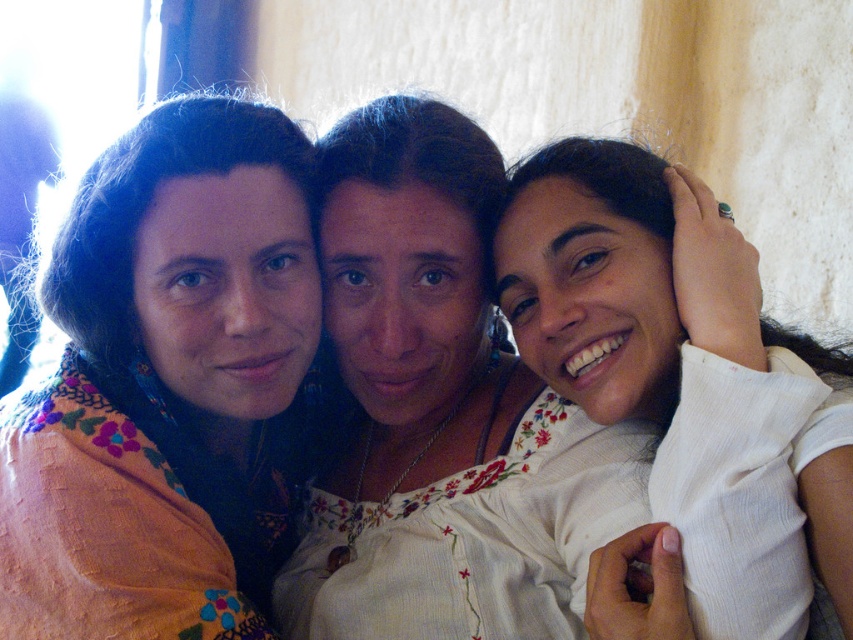
Question: Does embroidered fabric at center appear on the right side of white embroidered blouse at center?

Choices:
 (A) no
 (B) yes

Answer: (A)

Question: Which object is closer to the camera taking this photo?

Choices:
 (A) embroidered fabric at center
 (B) white embroidered blouse at center

Answer: (A)

Question: Is embroidered fabric at center above white embroidered blouse at center?

Choices:
 (A) no
 (B) yes

Answer: (A)

Question: Which object appears farthest from the camera in this image?

Choices:
 (A) white embroidered blouse at center
 (B) embroidered fabric at center

Answer: (A)

Question: Which point is closer to the camera?

Choices:
 (A) (233, 204)
 (B) (436, 326)

Answer: (A)

Question: Is embroidered fabric at center smaller than white embroidered blouse at center?

Choices:
 (A) no
 (B) yes

Answer: (B)